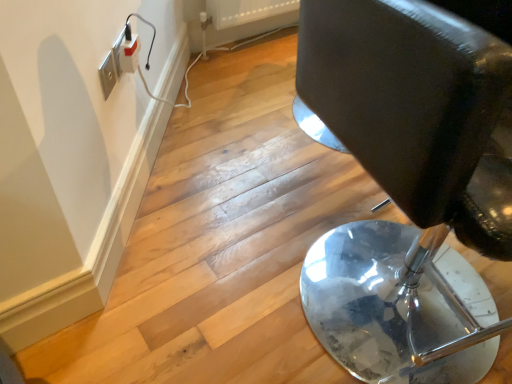
Locate an element on the screen. black leather chair at right is located at coordinates click(x=410, y=187).

What do you see at coordinates (410, 187) in the screenshot?
I see `black leather chair at right` at bounding box center [410, 187].

What is the approximate height of black leather chair at right?

black leather chair at right is 36.00 inches in height.

Locate an element on the screen. black leather chair at right is located at coordinates (410, 187).